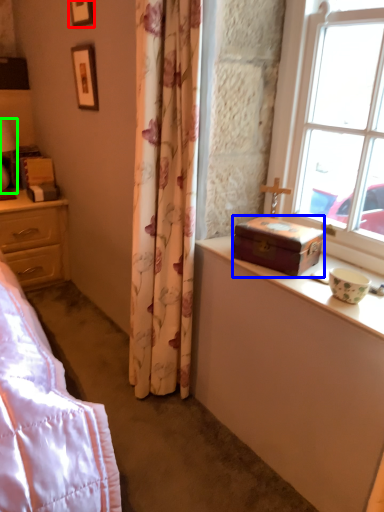
Question: Which object is the closest to the picture frame (highlighted by a red box)? Choose among these: box (highlighted by a blue box) or table lamp (highlighted by a green box).

Choices:
 (A) box
 (B) table lamp

Answer: (B)